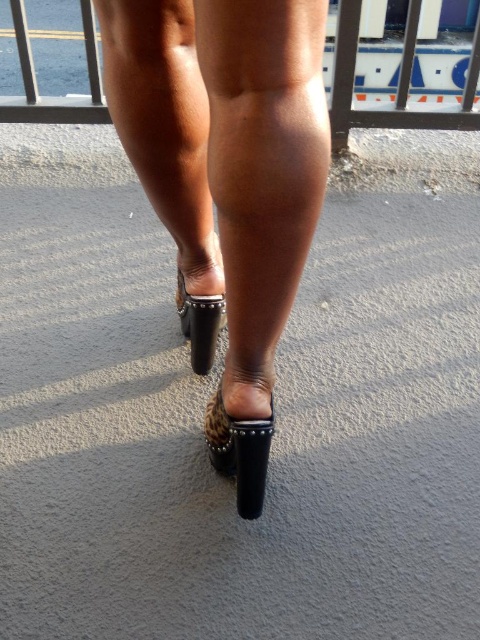
Question: Can you confirm if leather studded mule at lower center is wider than leather studded sandal at center?

Choices:
 (A) no
 (B) yes

Answer: (B)

Question: Which of the following is the farthest from the observer?

Choices:
 (A) (217, 467)
 (B) (25, 28)
 (C) (196, 227)

Answer: (B)

Question: Estimate the real-world distances between objects in this image. Which object is farther from the metallic silver rail at upper center?

Choices:
 (A) leather high-heeled shoe at center
 (B) leather studded sandal at lower center
 (C) leather studded mule at lower center

Answer: (B)

Question: Which object appears farthest from the camera in this image?

Choices:
 (A) metallic silver rail at upper center
 (B) leather high-heeled shoe at center
 (C) leather studded sandal at lower center
 (D) leather studded mule at lower center

Answer: (A)

Question: Does leather high-heeled shoe at center lie behind leather studded mule at lower center?

Choices:
 (A) no
 (B) yes

Answer: (A)

Question: Is leather high-heeled shoe at center positioned in front of leather studded mule at lower center?

Choices:
 (A) yes
 (B) no

Answer: (A)